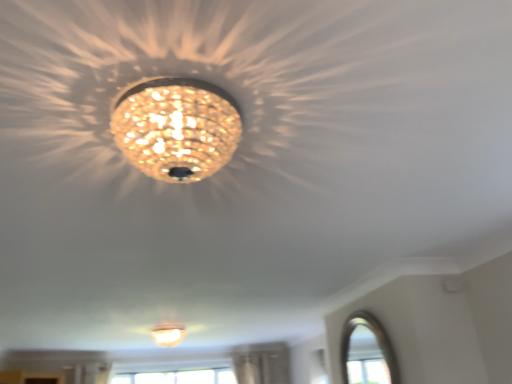
Question: Considering their positions, is clear glass window at lower right located in front of or behind matte gold chandelier at center, which appears as the 2th lamp when ordered from the bottom?

Choices:
 (A) behind
 (B) front

Answer: (A)

Question: Visually, is clear glass window at lower right positioned to the left or to the right of matte gold chandelier at center, the first lamp positioned from the top?

Choices:
 (A) left
 (B) right

Answer: (B)

Question: Estimate the real-world distances between objects in this image. Which object is farther from the clear glass window at lower right?

Choices:
 (A) matte white lampshade at center, positioned as the first lamp in bottom-to-top order
 (B) matte gold chandelier at center, which appears as the 2th lamp when ordered from the bottom

Answer: (B)

Question: Which is farther from the matte gold chandelier at center, which is the 2th lamp in back-to-front order?

Choices:
 (A) matte white lampshade at center, the second lamp from the right
 (B) clear glass window at lower right

Answer: (A)